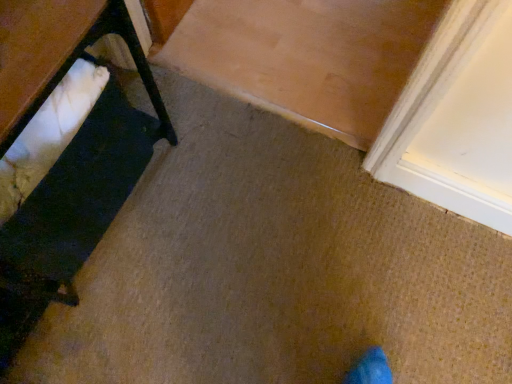
Find the location of a particular element. white fabric at left is located at coordinates (86, 53).

Describe the element at coordinates (86, 53) in the screenshot. I see `white fabric at left` at that location.

What do you see at coordinates (75, 190) in the screenshot? I see `white fabric cushion at left` at bounding box center [75, 190].

Identify the location of white fabric cushion at left. (75, 190).

What is the approximate height of white fabric cushion at left?

white fabric cushion at left is 33.77 centimeters in height.

You are a GUI agent. You are given a task and a screenshot of the screen. Output one action in this format:
    pyautogui.click(x=<x>, y=<y>)
    Task: Click on the white fabric at left
    The image size is (512, 384).
    Given the screenshot: What is the action you would take?
    pyautogui.click(x=86, y=53)

In the scene shown: Which is more to the right, white fabric at left or white fabric cushion at left?

From the viewer's perspective, white fabric cushion at left appears more on the right side.

Is white fabric at left further to camera compared to white fabric cushion at left?

No, it is in front of white fabric cushion at left.

Does point (148, 75) come behind point (146, 70)?

That is True.

From the image's perspective, is white fabric at left located above or below white fabric cushion at left?

white fabric at left is above white fabric cushion at left.

From a real-world perspective, is white fabric at left physically below white fabric cushion at left?

Incorrect, from a real-world perspective, white fabric at left is higher than white fabric cushion at left.

Considering the sizes of objects white fabric at left and white fabric cushion at left in the image provided, who is wider, white fabric at left or white fabric cushion at left?

Wider between the two is white fabric at left.

Considering the sizes of white fabric at left and white fabric cushion at left in the image, is white fabric at left taller or shorter than white fabric cushion at left?

white fabric at left is shorter than white fabric cushion at left.

Which of these two, white fabric at left or white fabric cushion at left, is bigger?

white fabric cushion at left is bigger.

Is white fabric at left completely or partially outside of white fabric cushion at left?

No.

Is there a large distance between white fabric at left and white fabric cushion at left?

No, white fabric at left is not far from white fabric cushion at left.

Is white fabric at left looking in the opposite direction of white fabric cushion at left?

Correct, white fabric at left is looking away from white fabric cushion at left.

How different are the orientations of white fabric at left and white fabric cushion at left in degrees?

0.0015 degrees separate the facing orientations of white fabric at left and white fabric cushion at left.

How far apart are white fabric at left and white fabric cushion at left?

5.76 inches.

Locate an element on the screen. The height and width of the screenshot is (384, 512). furniture that is behind the white fabric at left is located at coordinates 75,190.

Considering the positions of objects white fabric cushion at left and white fabric at left in the image provided, who is more to the right, white fabric cushion at left or white fabric at left?

Positioned to the right is white fabric cushion at left.

Considering the relative positions of white fabric cushion at left and white fabric at left in the image provided, is white fabric cushion at left in front of white fabric at left?

No, it is not.

Which is behind, point (70, 195) or point (168, 125)?

The point (168, 125) is farther.

From the image's perspective, is white fabric cushion at left located above white fabric at left?

Incorrect, from the image's perspective, white fabric cushion at left is lower than white fabric at left.

From a real-world perspective, relative to white fabric at left, is white fabric cushion at left vertically above or below?

In terms of real-world spatial position, white fabric cushion at left is below white fabric at left.

Considering the sizes of objects white fabric cushion at left and white fabric at left in the image provided, who is wider, white fabric cushion at left or white fabric at left?

white fabric at left.

Based on the photo, considering the sizes of objects white fabric cushion at left and white fabric at left in the image provided, who is taller, white fabric cushion at left or white fabric at left?

Standing taller between the two is white fabric cushion at left.

Is white fabric cushion at left bigger than white fabric at left?

Indeed, white fabric cushion at left has a larger size compared to white fabric at left.

Do you think white fabric cushion at left is within white fabric at left, or outside of it?

white fabric cushion at left lies within the bounds of white fabric at left.

Are white fabric cushion at left and white fabric at left far apart?

They are positioned close to each other.

Is white fabric cushion at left facing away from white fabric at left?

No, white fabric at left is not at the back of white fabric cushion at left.

Measure the distance from white fabric cushion at left to white fabric at left.

white fabric cushion at left and white fabric at left are 5.76 inches apart from each other.

Find the location of `furniture that is under the white fabric at left (from a real-world perspective)`. furniture that is under the white fabric at left (from a real-world perspective) is located at coordinates (75, 190).

Locate an element on the screen. furniture lying below the white fabric at left (from the image's perspective) is located at coordinates (75, 190).

You are a GUI agent. You are given a task and a screenshot of the screen. Output one action in this format:
    pyautogui.click(x=<x>, y=<y>)
    Task: Click on the table in front of the white fabric cushion at left
    This screenshot has width=512, height=384.
    Given the screenshot: What is the action you would take?
    pyautogui.click(x=86, y=53)